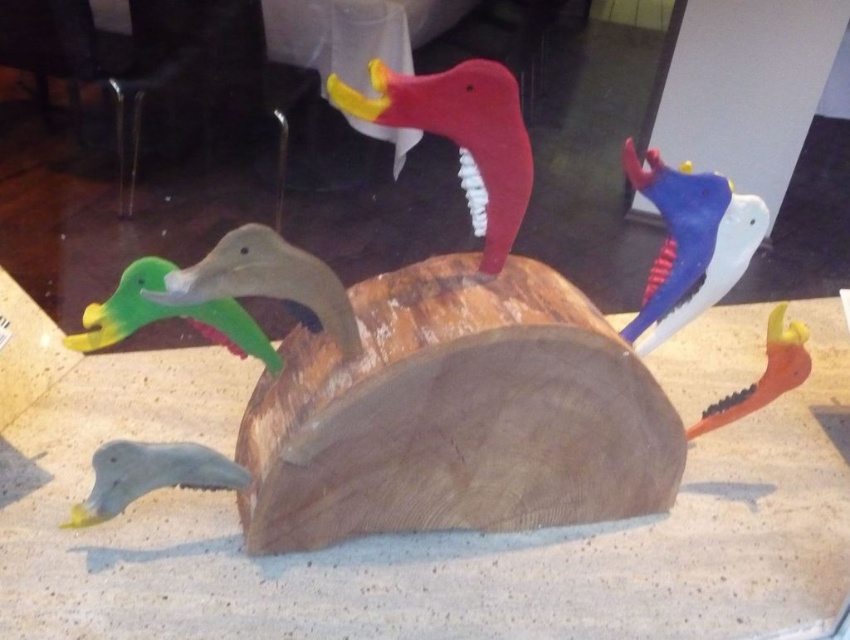
Can you confirm if white matte bird at upper right is bigger than matte gray duck at lower left?

Correct, white matte bird at upper right is larger in size than matte gray duck at lower left.

Which of these two, white matte bird at upper right or matte gray duck at lower left, stands taller?

white matte bird at upper right

Identify the location of white matte bird at upper right. (690, 243).

Which of these two, green matte duck at left or matte gray duck at lower left, stands taller?

Standing taller between the two is green matte duck at left.

Based on the photo, which is more to the right, green matte duck at left or matte gray duck at lower left?

Positioned to the right is green matte duck at left.

Is point (132, 312) farther from viewer compared to point (190, 461)?

No, it is in front of (190, 461).

Identify the location of green matte duck at left. This screenshot has width=850, height=640. (168, 316).

Is white matte bird at upper right taller than matte green plastic duck at center?

Yes.

Locate an element on the screen. The image size is (850, 640). white matte bird at upper right is located at coordinates (690, 243).

What do you see at coordinates (690, 243) in the screenshot? I see `white matte bird at upper right` at bounding box center [690, 243].

I want to click on white matte bird at upper right, so click(690, 243).